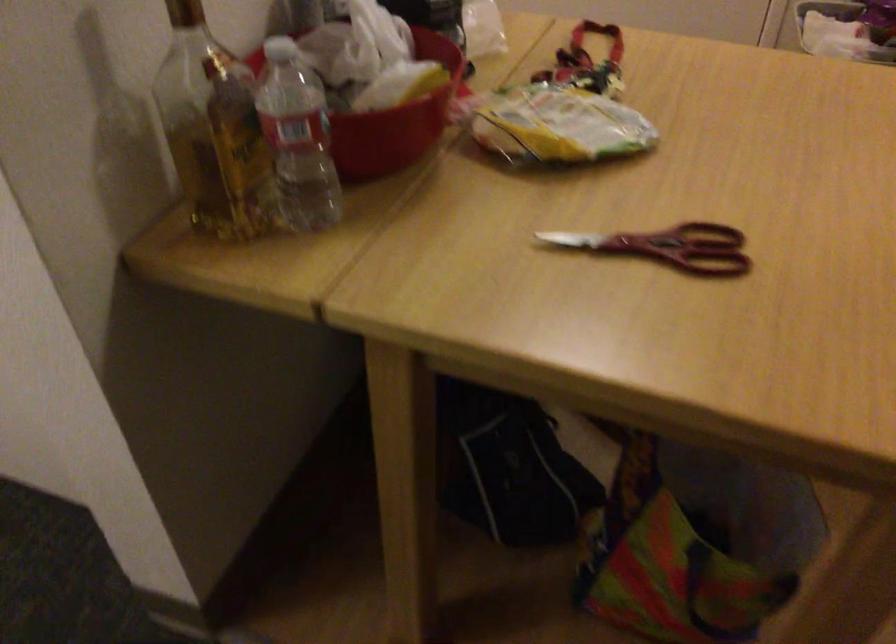
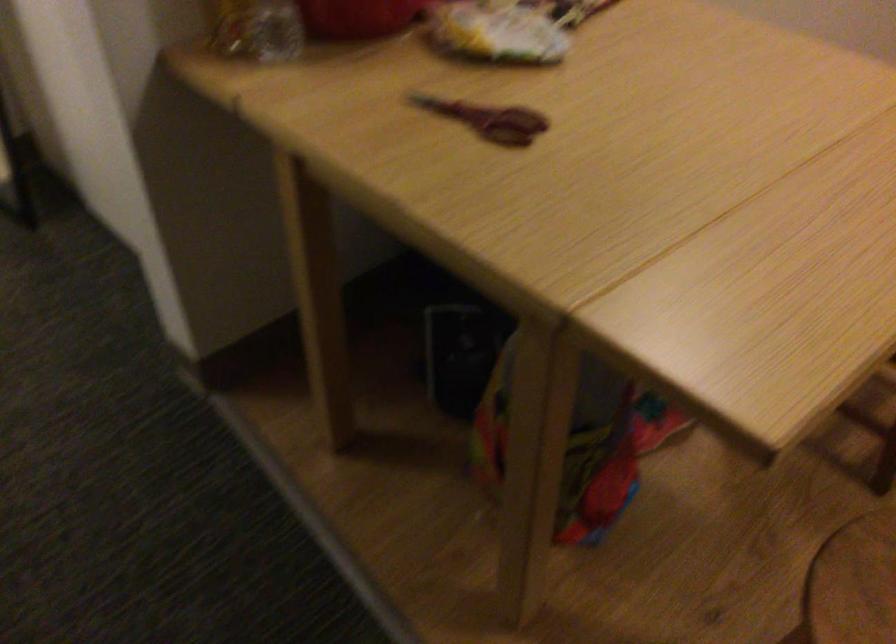
Question: How did the camera likely rotate?

Choices:
 (A) Left
 (B) Right
 (C) Up
 (D) Down

Answer: (A)